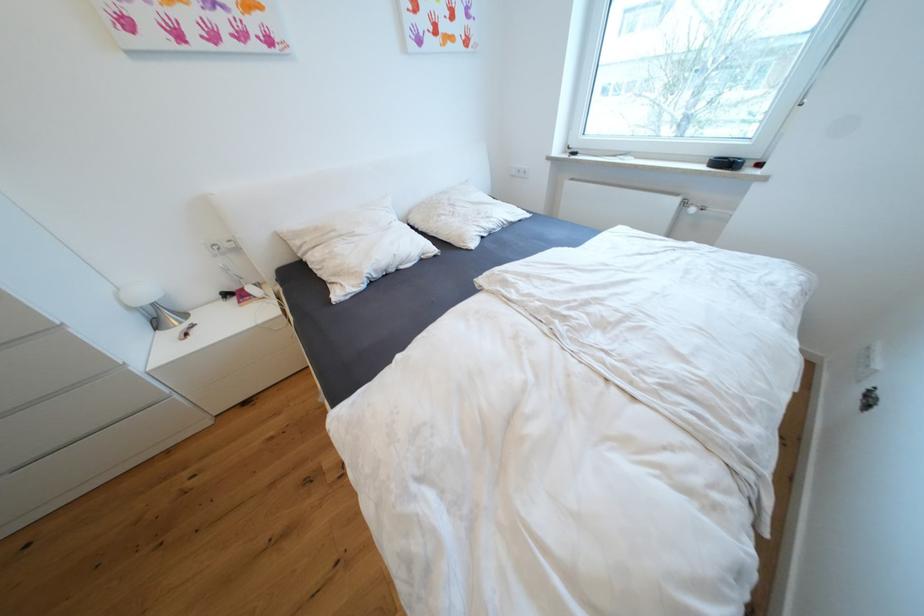
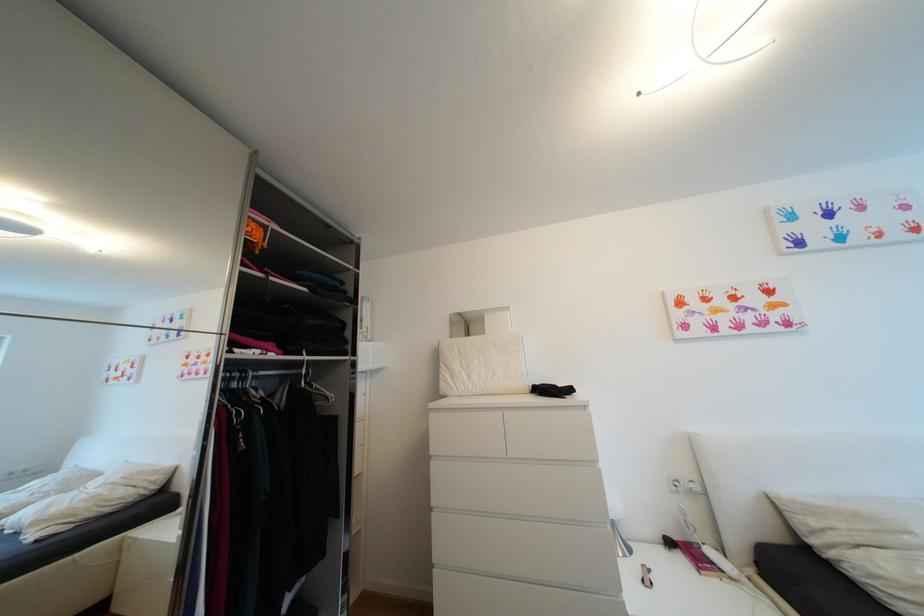
The first image is from the beginning of the video and the second image is from the end. How did the camera likely rotate when shooting the video?

The camera rotated toward left-up.